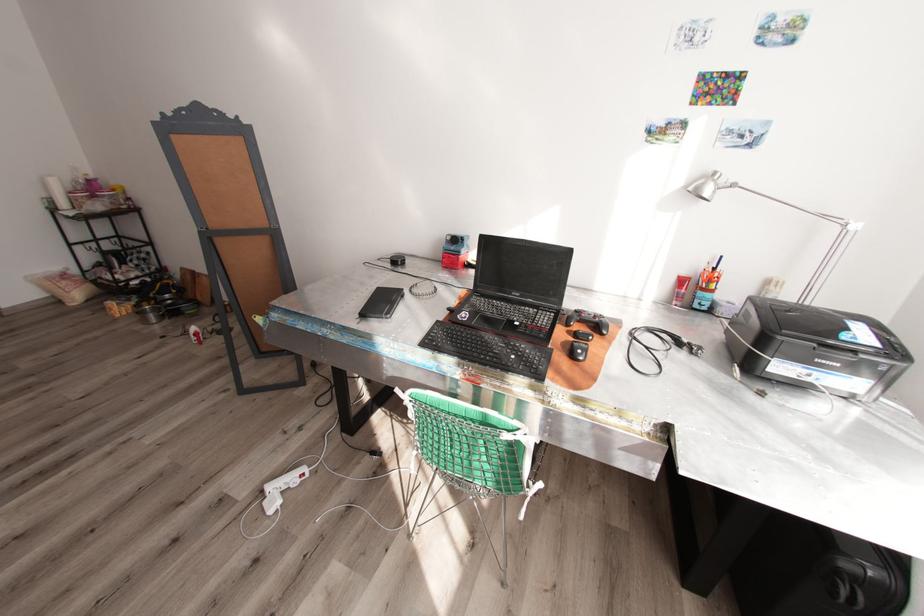
Find the location of a particular element. This screenshot has width=924, height=616. silver lamp head is located at coordinates (707, 188).